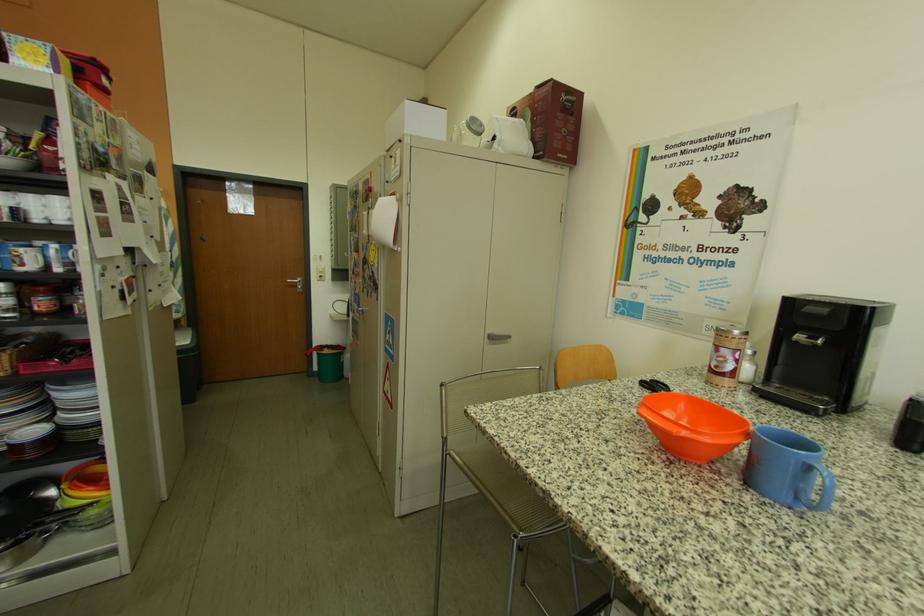
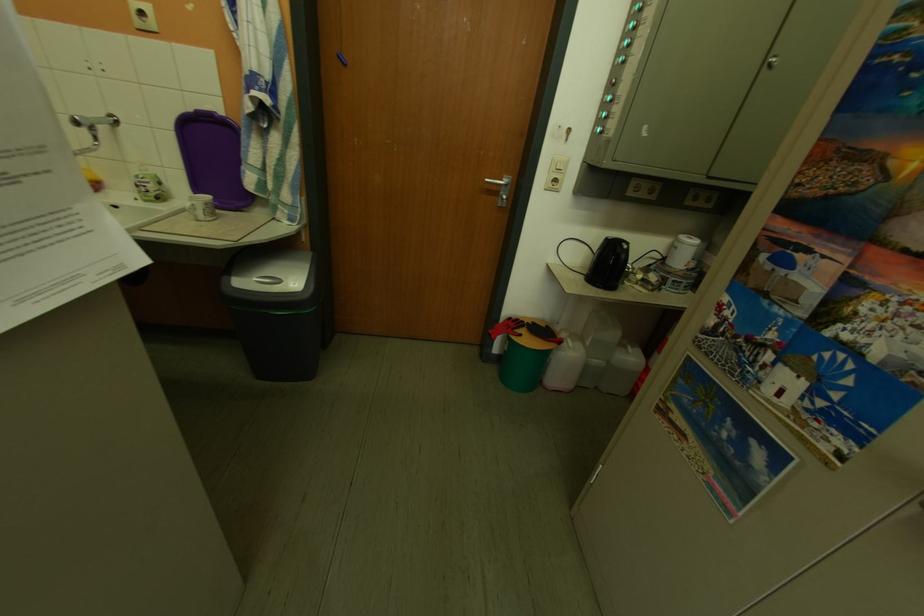
The point at (335, 353) is marked in the first image. Where is the corresponding point in the second image?

(533, 338)